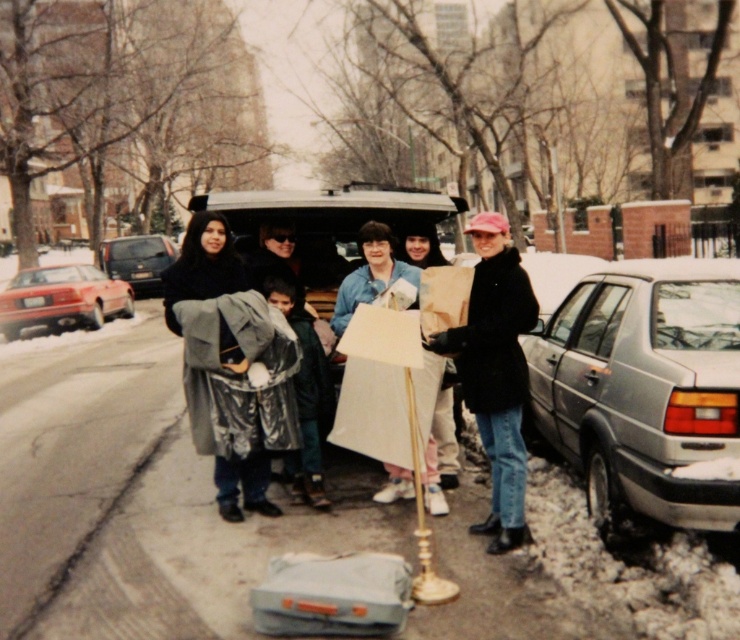
Question: Among these points, which one is farthest from the camera?

Choices:
 (A) (260, 317)
 (B) (110, 241)

Answer: (B)

Question: Which object is positioned closest to the silver metallic sedan at right?

Choices:
 (A) dark gray matte van at center
 (B) black fuzzy coat at center

Answer: (B)

Question: Is silver metallic sedan at right behind dark gray matte van at center?

Choices:
 (A) yes
 (B) no

Answer: (B)

Question: Which object is positioned closest to the shiny red car at left?

Choices:
 (A) silver metallic sedan at right
 (B) matte black coat at center
 (C) black fuzzy coat at center
 (D) dark gray matte van at center

Answer: (D)

Question: Observing the image, what is the correct spatial positioning of silver metallic sedan at right in reference to shiny red car at left?

Choices:
 (A) above
 (B) below

Answer: (B)

Question: Is dark gray wool coat at center smaller than dark gray matte van at center?

Choices:
 (A) no
 (B) yes

Answer: (B)